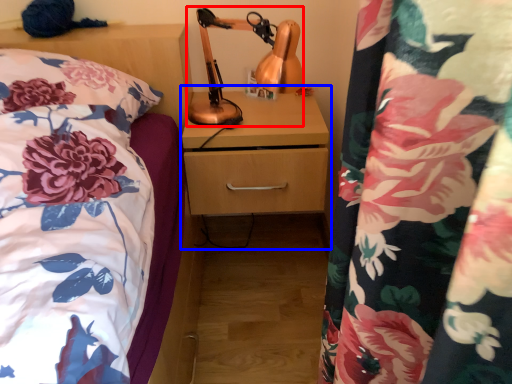
Question: Which of the following is the closest to the observer, table lamp (highlighted by a red box) or dresser (highlighted by a blue box)?

Choices:
 (A) table lamp
 (B) dresser

Answer: (A)